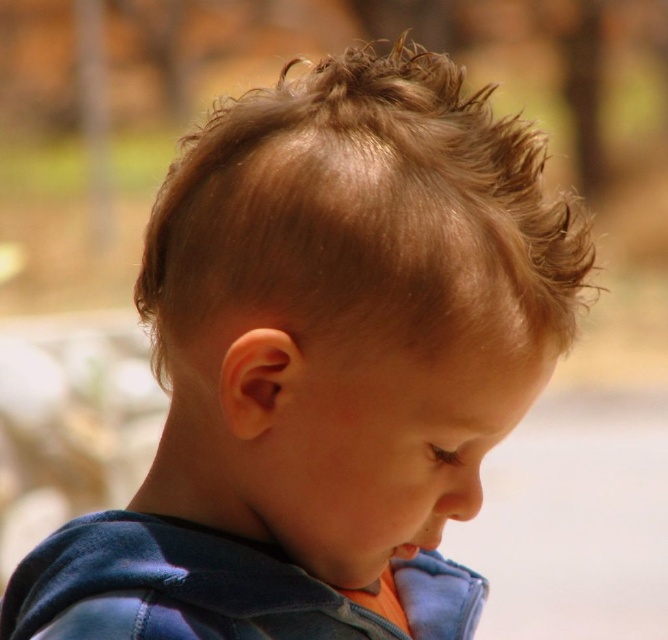
Is light brown textured hair at center to the right of velvet blue sweatshirt at lower left from the viewer's perspective?

In fact, light brown textured hair at center is to the left of velvet blue sweatshirt at lower left.

Who is positioned more to the left, light brown textured hair at center or velvet blue sweatshirt at lower left?

light brown textured hair at center

Who is more distant from viewer, (x=520, y=188) or (x=283, y=634)?

Point (x=283, y=634)

Identify the location of light brown textured hair at center. The width and height of the screenshot is (668, 640). (363, 211).